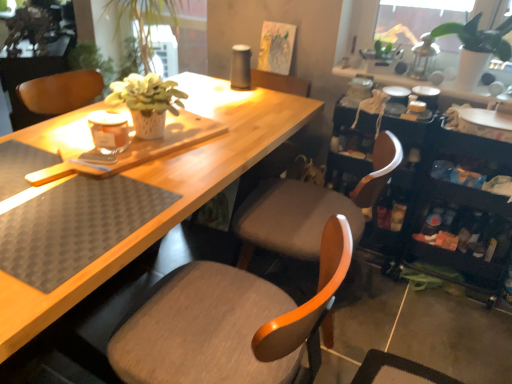
Question: Is point (330, 324) positioned closer to the camera than point (485, 61)?

Choices:
 (A) farther
 (B) closer

Answer: (B)

Question: From the image's perspective, is matte gray chair at center, which is the first chair in back-to-front order, located above or below white matte plant pot at upper right?

Choices:
 (A) below
 (B) above

Answer: (A)

Question: Based on their relative distances, which object is nearer to the matte gray chair at center, marked as the first chair in a front-to-back arrangement?

Choices:
 (A) white matte plant pot at upper right
 (B) black rubber placemat at lower left
 (C) matte gray chair at center, the 2th chair from the front

Answer: (B)

Question: Which object is positioned closest to the matte gray chair at center, marked as the first chair in a front-to-back arrangement?

Choices:
 (A) black rubber placemat at lower left
 (B) white matte plant pot at upper right
 (C) matte gray chair at center, which is the first chair in back-to-front order

Answer: (A)